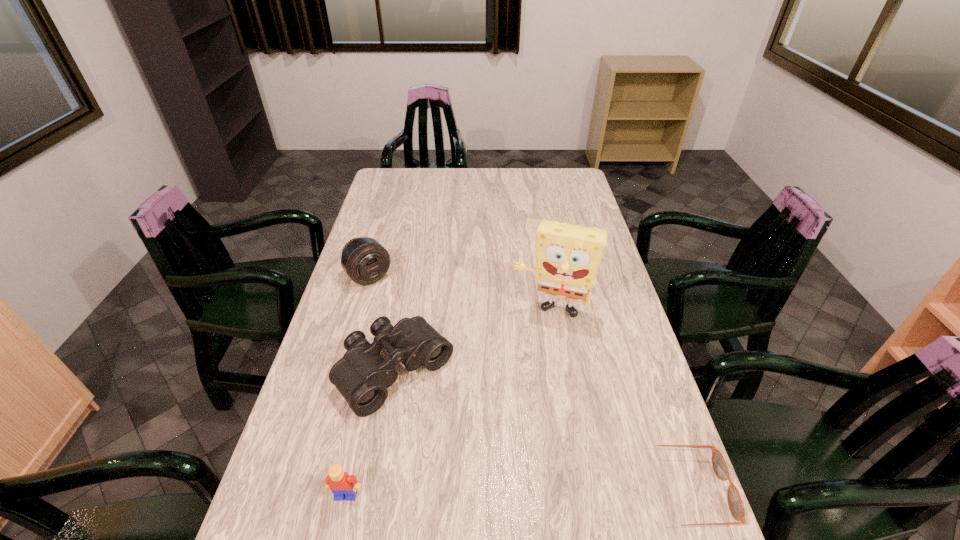
The width and height of the screenshot is (960, 540). I want to click on vacant space on the desktop that is between the Lego and the sunglasses and is positioned at the eyepieces of the third nearest object, so click(x=503, y=494).

This screenshot has height=540, width=960. In order to click on free space on the desktop that is between the Lego and the rightmost object and is positioned on the face of the fourth object from left to right in this screenshot , I will do `click(502, 494)`.

At what (x,y) coordinates should I click in order to perform the action: click on free space on the desktop that is between the Lego and the sunglasses and is positioned on the front-facing side of the telephoto lens. Please return your answer as a coordinate pair (x, y). The image size is (960, 540). Looking at the image, I should click on (565, 492).